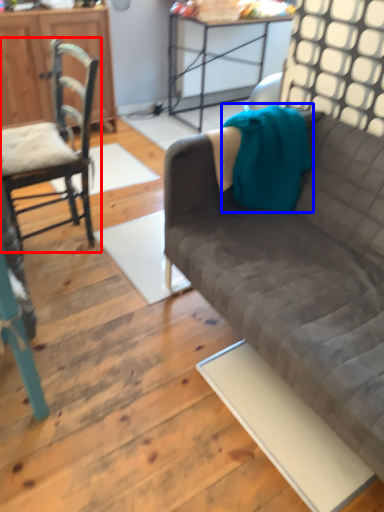
Question: Which object appears closest to the camera in this image, chair (highlighted by a red box) or blanket (highlighted by a blue box)?

Choices:
 (A) chair
 (B) blanket

Answer: (A)